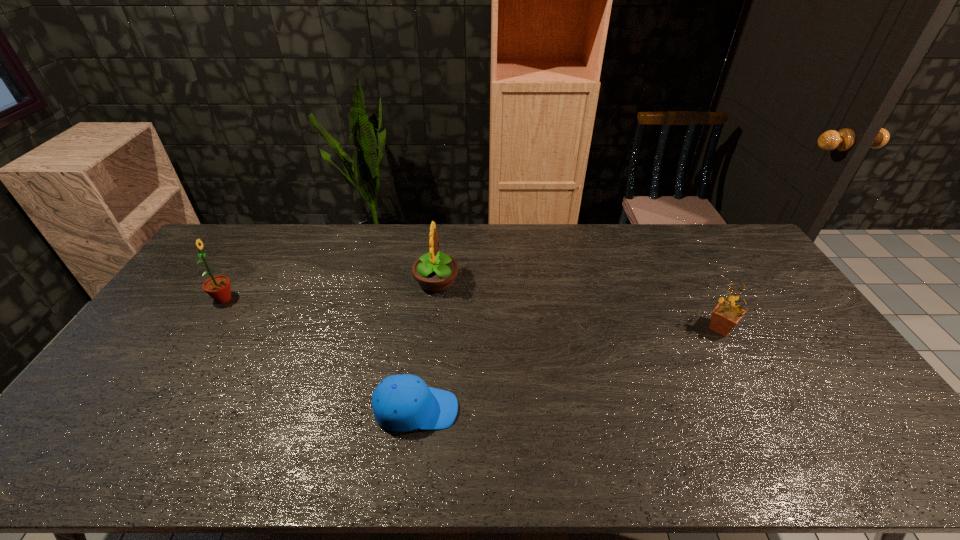
The height and width of the screenshot is (540, 960). In order to click on vacant space in between the second nearest object and the second sunflower from right to left in this screenshot , I will do `click(579, 305)`.

At what (x,y) coordinates should I click in order to perform the action: click on unoccupied area between the nearest sunflower and the second sunflower from right to left. Please return your answer as a coordinate pair (x, y). The width and height of the screenshot is (960, 540). Looking at the image, I should click on (579, 305).

The height and width of the screenshot is (540, 960). I want to click on vacant area between the leftmost object and the second sunflower from left to right, so click(330, 290).

Where is `vacant area that lies between the nearest sunflower and the second sunflower from left to right`? The width and height of the screenshot is (960, 540). vacant area that lies between the nearest sunflower and the second sunflower from left to right is located at coordinates (579, 305).

Locate an element on the screen. The image size is (960, 540). vacant region between the cap and the nearest sunflower is located at coordinates (568, 369).

The height and width of the screenshot is (540, 960). I want to click on vacant space that's between the leftmost sunflower and the second sunflower from left to right, so pyautogui.click(x=330, y=290).

You are a GUI agent. You are given a task and a screenshot of the screen. Output one action in this format:
    pyautogui.click(x=<x>, y=<y>)
    Task: Click on the blank region between the second sunflower from left to right and the nearest object
    The image size is (960, 540).
    Given the screenshot: What is the action you would take?
    pyautogui.click(x=426, y=346)

This screenshot has width=960, height=540. Identify the location of free space between the leftmost object and the nearest object. (320, 354).

The width and height of the screenshot is (960, 540). I want to click on vacant space that is in between the second sunflower from right to left and the shortest object, so click(x=426, y=346).

Select which object is the third closest to the cap. Please provide its 2D coordinates. Your answer should be formatted as a tuple, i.e. [(x, y)], where the tuple contains the x and y coordinates of a point satisfying the conditions above.

[(725, 316)]